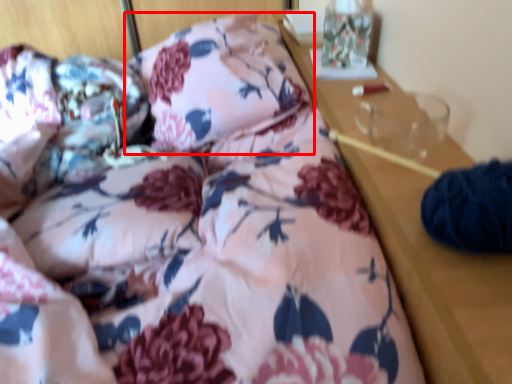
Question: Where is pillow (annotated by the red box) located in relation to pillow in the image?

Choices:
 (A) right
 (B) left

Answer: (B)